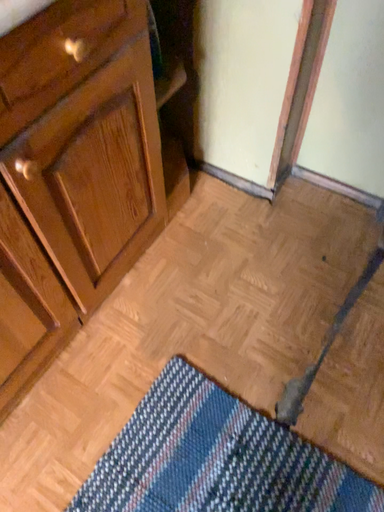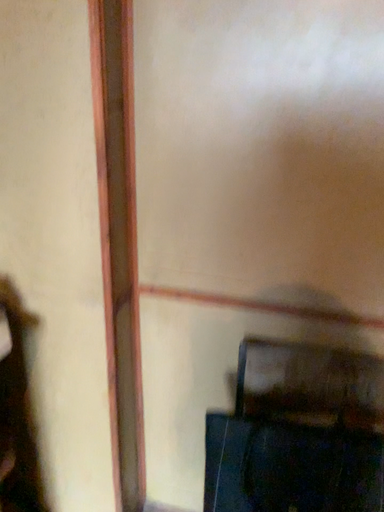
Question: How did the camera likely rotate when shooting the video?

Choices:
 (A) rotated downward
 (B) rotated upward

Answer: (B)